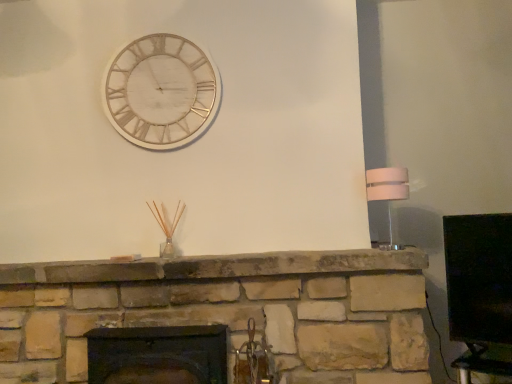
Question: Is white glossy lampshade at right bigger or smaller than white marble clock at upper center?

Choices:
 (A) big
 (B) small

Answer: (B)

Question: Would you say white glossy lampshade at right is to the left or to the right of white marble clock at upper center in the picture?

Choices:
 (A) left
 (B) right

Answer: (B)

Question: Which is farther from the white marble clock at upper center?

Choices:
 (A) dark brown wood fireplace at center
 (B) white glossy lampshade at right

Answer: (B)

Question: Estimate the real-world distances between objects in this image. Which object is closer to the white glossy lampshade at right?

Choices:
 (A) dark brown wood fireplace at center
 (B) white marble clock at upper center

Answer: (B)